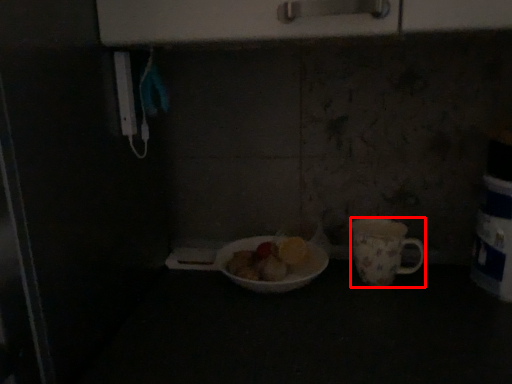
Question: Observing the image, what is the correct spatial positioning of coffee cup (annotated by the red box) in reference to tableware?

Choices:
 (A) right
 (B) left

Answer: (A)